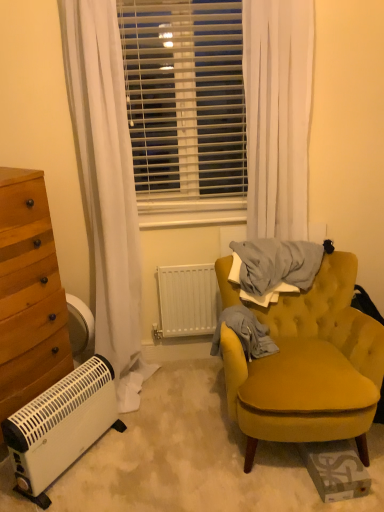
Locate an element on the screen. This screenshot has width=384, height=512. vacant position to the left of velvet yellow armchair at right is located at coordinates (172, 454).